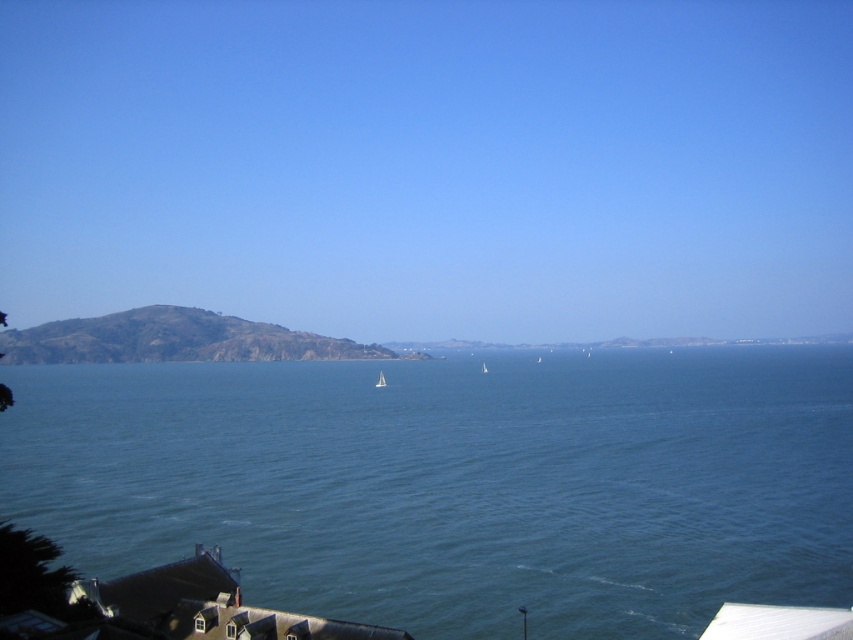
Is green grassy hill at left below white glossy sailboat at center?

Actually, green grassy hill at left is above white glossy sailboat at center.

Is green grassy hill at left wider than white glossy sailboat at center?

Indeed, green grassy hill at left has a greater width compared to white glossy sailboat at center.

Between point (312, 337) and point (384, 378), which one is positioned behind?

The point (312, 337) is behind.

Where is `green grassy hill at left`? This screenshot has width=853, height=640. green grassy hill at left is located at coordinates (175, 339).

Is green grassy hill at left bigger than white matte sailboat at center?

Yes.

Does point (178, 342) come in front of point (486, 371)?

No, (178, 342) is further to viewer.

Who is more distant from viewer, (100, 336) or (486, 368)?

The point (100, 336) is behind.

I want to click on green grassy hill at left, so click(x=175, y=339).

Consider the image. Between white glossy sailboat at center and white matte sailboat at center, which one appears on the left side from the viewer's perspective?

white glossy sailboat at center

Does white glossy sailboat at center have a greater height compared to white matte sailboat at center?

Correct, white glossy sailboat at center is much taller as white matte sailboat at center.

Locate an element on the screen. This screenshot has height=640, width=853. white glossy sailboat at center is located at coordinates (380, 380).